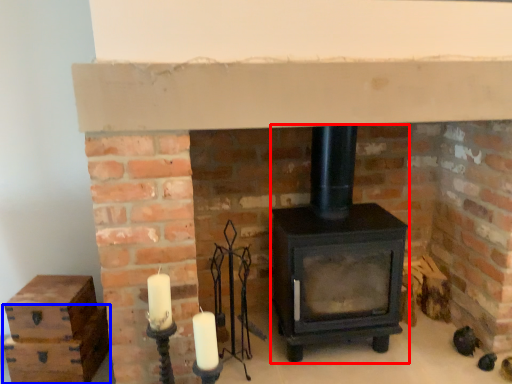
Question: Among these objects, which one is nearest to the camera, wood burning stove (highlighted by a red box) or drawer (highlighted by a blue box)?

Choices:
 (A) wood burning stove
 (B) drawer

Answer: (A)